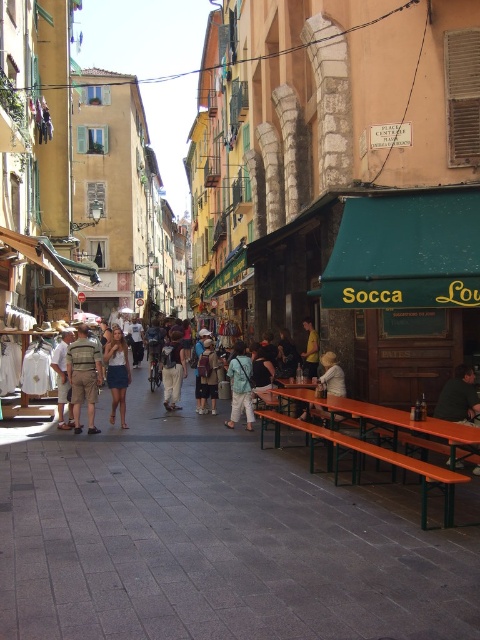
Question: Based on their relative distances, which object is farther from the light brown leather shorts at center?

Choices:
 (A) orange wood picnic table at lower right
 (B) light blue denim pants at center
 (C) dark green fabric at center

Answer: (A)

Question: Which point is closer to the camera?

Choices:
 (A) (339, 440)
 (B) (205, 401)
 (C) (464, 412)

Answer: (A)

Question: Considering the relative positions of light blue denim pants at center and brown leather backpack at center in the image provided, where is light blue denim pants at center located with respect to brown leather backpack at center?

Choices:
 (A) below
 (B) above

Answer: (A)

Question: Can you confirm if camouflage-patterned shorts at center is positioned below dark green fabric at center?

Choices:
 (A) no
 (B) yes

Answer: (B)

Question: Is camouflage-patterned shorts at center behind light beige pants at center?

Choices:
 (A) yes
 (B) no

Answer: (B)

Question: Which object is farther from the camera taking this photo?

Choices:
 (A) orange wood picnic table at lower right
 (B) wooden bench at center

Answer: (A)